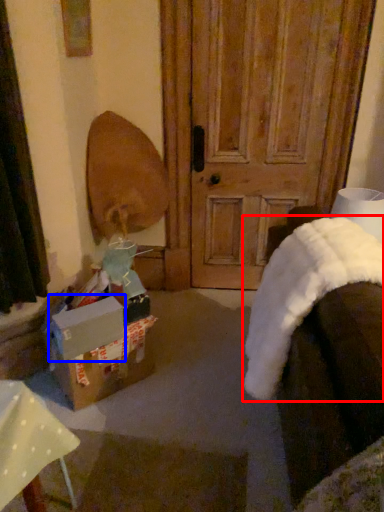
Question: Which point is further to the camera, blanket (highlighted by a red box) or cardboard box (highlighted by a blue box)?

Choices:
 (A) blanket
 (B) cardboard box

Answer: (B)